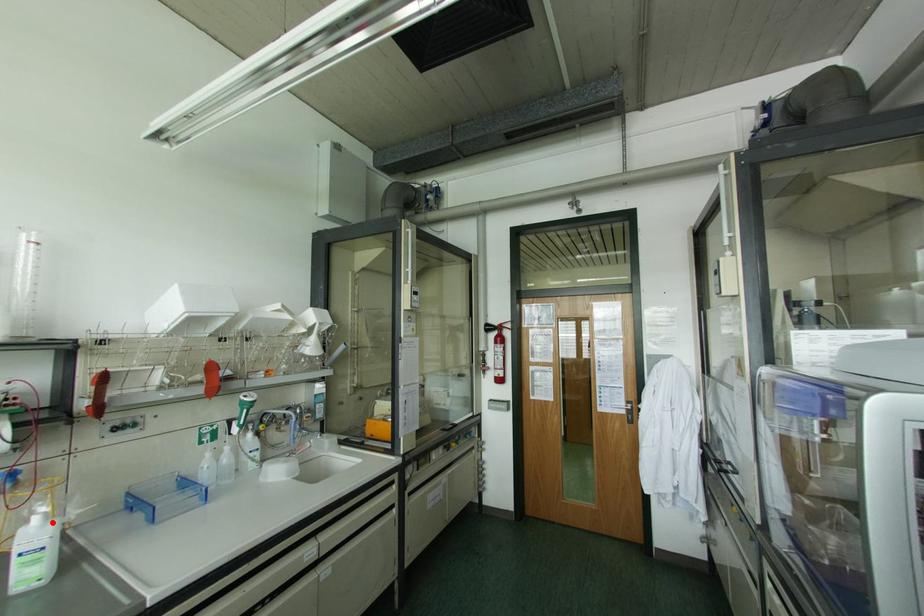
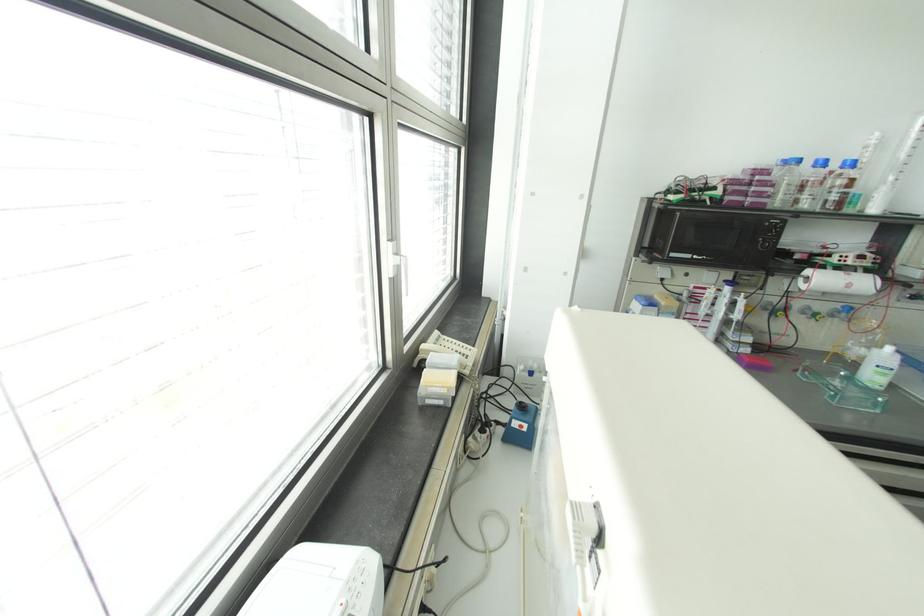
Where in the second image is the point corresponding to the highlighted location from the first image?

(898, 355)